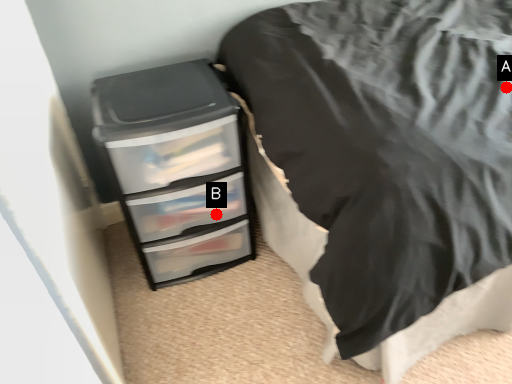
Question: Two points are circled on the image, labeled by A and B beside each circle. Which point is farther to the camera?

Choices:
 (A) A is further
 (B) B is further

Answer: (B)